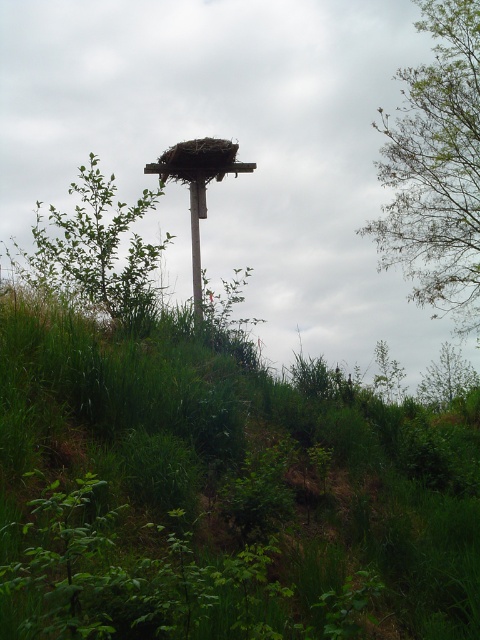
Question: Considering the relative positions of green grass at center and green leafy tree at upper right in the image provided, where is green grass at center located with respect to green leafy tree at upper right?

Choices:
 (A) below
 (B) above

Answer: (A)

Question: Considering the real-world distances, which object is farthest from the green leafy tree at upper right?

Choices:
 (A) green leafy tree at center
 (B) green grass at center

Answer: (B)

Question: Which point is closer to the camera taking this photo?

Choices:
 (A) (418, 132)
 (B) (13, 586)

Answer: (B)

Question: Among these objects, which one is farthest from the camera?

Choices:
 (A) green leafy tree at upper right
 (B) green leafy tree at center
 (C) green grass at center

Answer: (A)

Question: Is green grass at center above green leafy tree at center?

Choices:
 (A) no
 (B) yes

Answer: (A)

Question: Is green grass at center above green leafy tree at upper right?

Choices:
 (A) no
 (B) yes

Answer: (A)